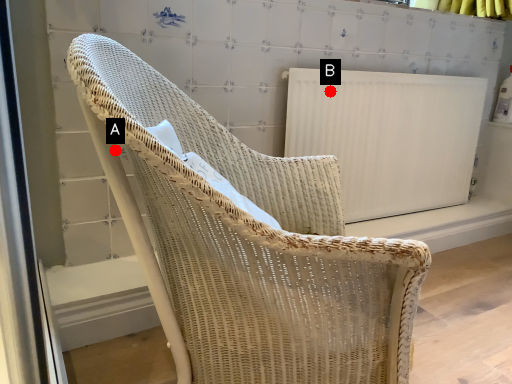
Question: Two points are circled on the image, labeled by A and B beside each circle. Which point is closer to the camera?

Choices:
 (A) A is closer
 (B) B is closer

Answer: (A)